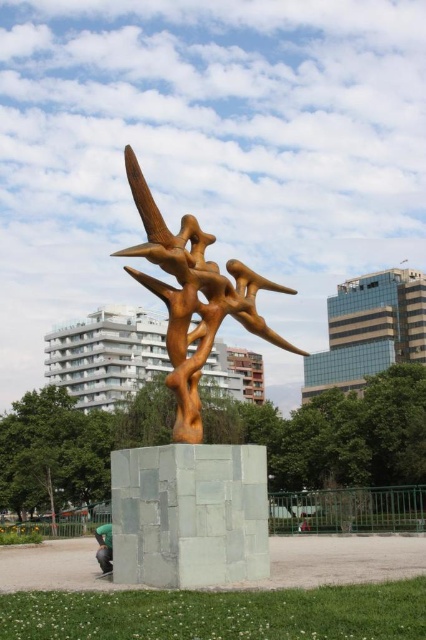
Question: Which point is farther to the camera?

Choices:
 (A) (94, 531)
 (B) (175, 424)

Answer: (A)

Question: Observing the image, what is the correct spatial positioning of bronze/sculpture at center in reference to green fabric person at lower left?

Choices:
 (A) below
 (B) above

Answer: (B)

Question: Does bronze/sculpture at center have a smaller size compared to green fabric person at lower left?

Choices:
 (A) yes
 (B) no

Answer: (B)

Question: Which point is closer to the camera taking this photo?

Choices:
 (A) (94, 532)
 (B) (175, 308)

Answer: (B)

Question: From the image, what is the correct spatial relationship of bronze/sculpture at center in relation to green fabric person at lower left?

Choices:
 (A) left
 (B) right

Answer: (B)